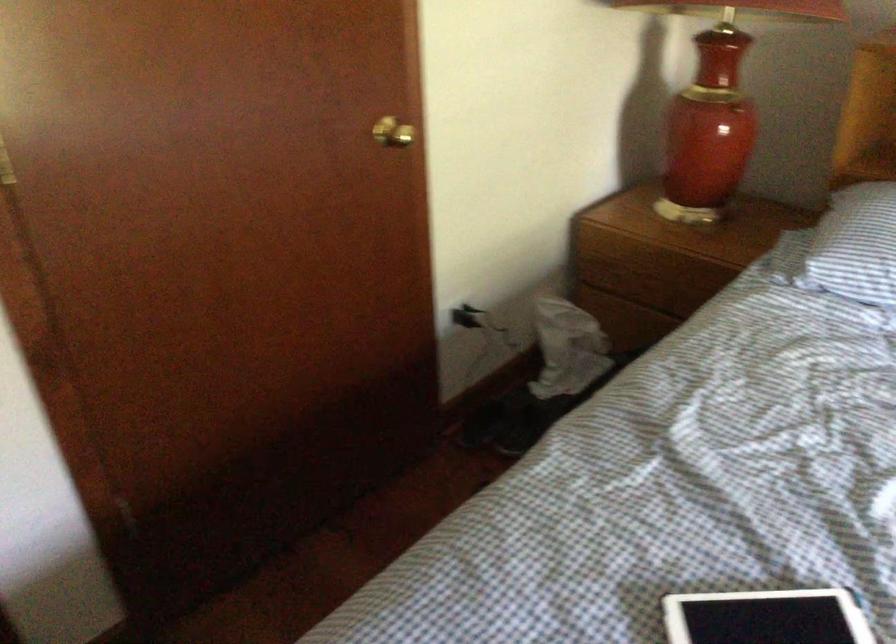
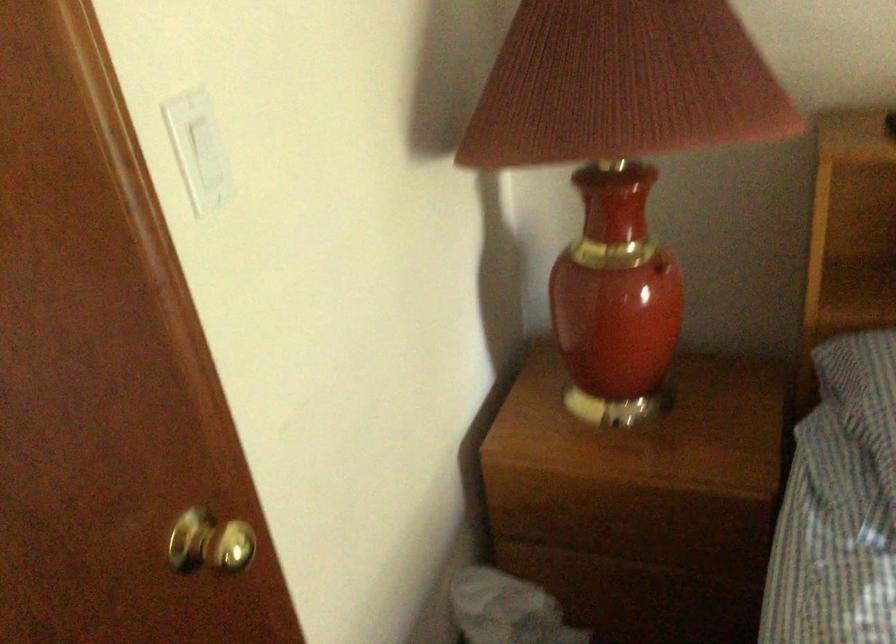
Question: Based on the continuous images, in which direction is the camera rotating? Reply with the corresponding letter.

Choices:
 (A) Left
 (B) Right
 (C) Up
 (D) Down

Answer: (B)